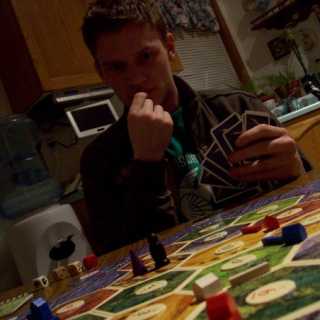
Identify the location of counter. (286, 117).